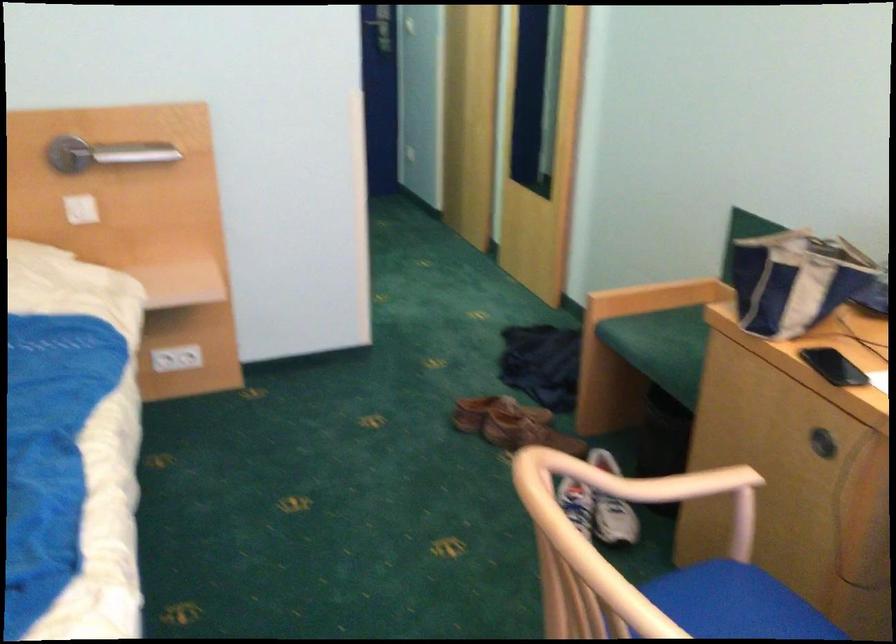
Locate an element on the screen. black smartphone is located at coordinates (832, 366).